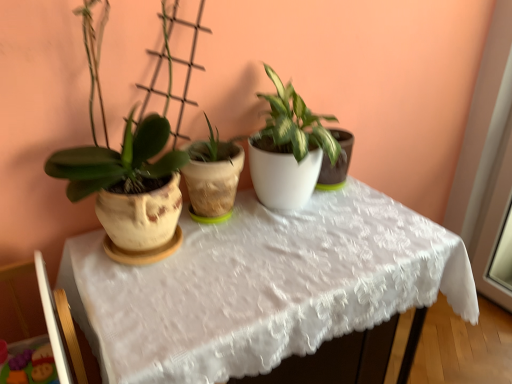
What do you see at coordinates (128, 177) in the screenshot? Image resolution: width=512 pixels, height=384 pixels. I see `matte clay pot at left` at bounding box center [128, 177].

Where is `matte clay pot at left`? The width and height of the screenshot is (512, 384). matte clay pot at left is located at coordinates (128, 177).

What is the approximate width of white lace tablecloth at center?

21.42 inches.

Image resolution: width=512 pixels, height=384 pixels. Describe the element at coordinates (262, 286) in the screenshot. I see `white lace tablecloth at center` at that location.

At what (x,y) coordinates should I click in order to perform the action: click on white lace tablecloth at center. Please return your answer as a coordinate pair (x, y). Image resolution: width=512 pixels, height=384 pixels. Looking at the image, I should click on (262, 286).

You are a GUI agent. You are given a task and a screenshot of the screen. Output one action in this format:
    pyautogui.click(x=<x>, y=<y>)
    Task: Click on the matte clay pot at left
    
    Given the screenshot: What is the action you would take?
    pyautogui.click(x=128, y=177)

Is white lace tablecloth at center at the left side of matte clay pot at left?

No, white lace tablecloth at center is not to the left of matte clay pot at left.

In the image, is white lace tablecloth at center positioned in front of or behind matte clay pot at left?

white lace tablecloth at center is positioned farther from the viewer than matte clay pot at left.

Is point (276, 257) positioned before point (165, 154)?

Yes.

From the image's perspective, would you say white lace tablecloth at center is positioned over matte clay pot at left?

No.

From a real-world perspective, is white lace tablecloth at center over matte clay pot at left?

No, from a real-world perspective, white lace tablecloth at center is not on top of matte clay pot at left.

In terms of width, does white lace tablecloth at center look wider or thinner when compared to matte clay pot at left?

white lace tablecloth at center is wider than matte clay pot at left.

Can you confirm if white lace tablecloth at center is shorter than matte clay pot at left?

No.

Can you confirm if white lace tablecloth at center is smaller than matte clay pot at left?

No.

Is white lace tablecloth at center positioned beyond the bounds of matte clay pot at left?

Indeed, white lace tablecloth at center is completely outside matte clay pot at left.

Would you say white lace tablecloth at center is a long distance from matte clay pot at left?

No, there isn't a large distance between white lace tablecloth at center and matte clay pot at left.

Is white lace tablecloth at center oriented away from matte clay pot at left?

No.

From the picture: How different are the orientations of white lace tablecloth at center and matte clay pot at left in degrees?

0.579 degrees separate the facing orientations of white lace tablecloth at center and matte clay pot at left.

In order to click on houseplant above the white lace tablecloth at center (from the image's perspective) in this screenshot , I will do `click(128, 177)`.

Considering the relative positions of matte clay pot at left and white lace tablecloth at center in the image provided, is matte clay pot at left to the right of white lace tablecloth at center from the viewer's perspective?

No.

Which object is further away from the camera, matte clay pot at left or white lace tablecloth at center?

white lace tablecloth at center is further away from the camera.

Is point (167, 240) positioned before point (92, 308)?

That is False.

From the image's perspective, which is above, matte clay pot at left or white lace tablecloth at center?

matte clay pot at left appears higher in the image.

From a real-world perspective, is matte clay pot at left below white lace tablecloth at center?

No, from a real-world perspective, matte clay pot at left is not under white lace tablecloth at center.

Which of these two, matte clay pot at left or white lace tablecloth at center, is thinner?

Result: matte clay pot at left is thinner.

Which of these two, matte clay pot at left or white lace tablecloth at center, stands taller?

With more height is white lace tablecloth at center.

Which of these two, matte clay pot at left or white lace tablecloth at center, is bigger?

Bigger between the two is white lace tablecloth at center.

Which is correct: matte clay pot at left is inside white lace tablecloth at center, or outside of it?

matte clay pot at left exists outside the volume of white lace tablecloth at center.

Are matte clay pot at left and white lace tablecloth at center making contact?

They are not placed beside each other.

Is white lace tablecloth at center at the back of matte clay pot at left?

No, white lace tablecloth at center is not at the back of matte clay pot at left.

What's the angular difference between matte clay pot at left and white lace tablecloth at center's facing directions?

The angle between the facing direction of matte clay pot at left and the facing direction of white lace tablecloth at center is 0.579 degrees.

How far apart are matte clay pot at left and white lace tablecloth at center?

They are 11.19 inches apart.

This screenshot has width=512, height=384. In order to click on table behind the matte clay pot at left in this screenshot , I will do `click(262, 286)`.

Where is `houseplant located on the left of white lace tablecloth at center`? The image size is (512, 384). houseplant located on the left of white lace tablecloth at center is located at coordinates (128, 177).

This screenshot has width=512, height=384. I want to click on table located on the right of matte clay pot at left, so click(262, 286).